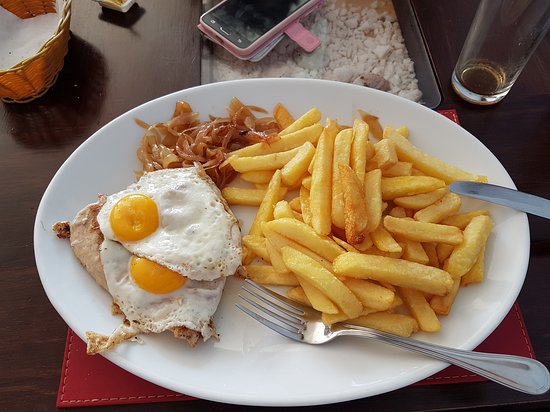
At what (x,y) coordinates should I click in order to perform the action: click on wooden table top. Please return your answer as a coordinate pair (x, y). The width and height of the screenshot is (550, 412). Looking at the image, I should click on (20, 302).